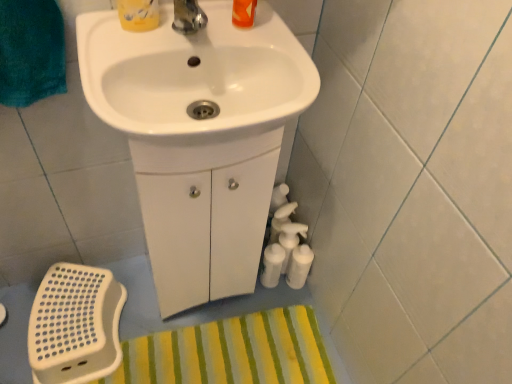
Question: From a real-world perspective, is yellow striped bath mat at lower center under white glossy sink at upper center, which ranks as the 1th sink in front-to-back order?

Choices:
 (A) yes
 (B) no

Answer: (A)

Question: Is yellow striped bath mat at lower center completely or partially outside of white glossy sink at upper center, marked as the 2th sink in a back-to-front arrangement?

Choices:
 (A) no
 (B) yes

Answer: (B)

Question: Does yellow striped bath mat at lower center turn towards white glossy sink at upper center, which ranks as the 1th sink in front-to-back order?

Choices:
 (A) yes
 (B) no

Answer: (B)

Question: Can white glossy sink at upper center, marked as the 2th sink in a back-to-front arrangement, be found inside yellow striped bath mat at lower center?

Choices:
 (A) yes
 (B) no

Answer: (B)

Question: From the image's perspective, would you say yellow striped bath mat at lower center is shown under white glossy sink at upper center, marked as the 2th sink in a back-to-front arrangement?

Choices:
 (A) yes
 (B) no

Answer: (A)

Question: From a real-world perspective, is yellow striped bath mat at lower center located higher than white glossy sink at upper center, which ranks as the 1th sink in front-to-back order?

Choices:
 (A) yes
 (B) no

Answer: (B)

Question: Considering the relative positions of white glossy sink at center, the second sink when ordered from front to back, and matte yellow container at upper center in the image provided, is white glossy sink at center, the second sink when ordered from front to back, behind matte yellow container at upper center?

Choices:
 (A) yes
 (B) no

Answer: (B)

Question: Is matte yellow container at upper center completely or partially inside white glossy sink at center, the second sink when ordered from front to back?

Choices:
 (A) yes
 (B) no

Answer: (B)

Question: Is white glossy sink at center, the second sink when ordered from front to back, oriented away from matte yellow container at upper center?

Choices:
 (A) yes
 (B) no

Answer: (B)

Question: Could you tell me if white glossy sink at center, the second sink when ordered from front to back, is facing matte yellow container at upper center?

Choices:
 (A) yes
 (B) no

Answer: (B)

Question: From the image's perspective, is white glossy sink at center, the second sink when ordered from front to back, on matte yellow container at upper center?

Choices:
 (A) no
 (B) yes

Answer: (A)

Question: Is white glossy sink at center, the first sink from the back, positioned far away from matte yellow container at upper center?

Choices:
 (A) no
 (B) yes

Answer: (A)

Question: Considering the relative positions of white glossy sink at center, the second sink when ordered from front to back, and white glossy sink at upper center, which ranks as the 1th sink in front-to-back order, in the image provided, is white glossy sink at center, the second sink when ordered from front to back, in front of white glossy sink at upper center, which ranks as the 1th sink in front-to-back order,?

Choices:
 (A) no
 (B) yes

Answer: (A)